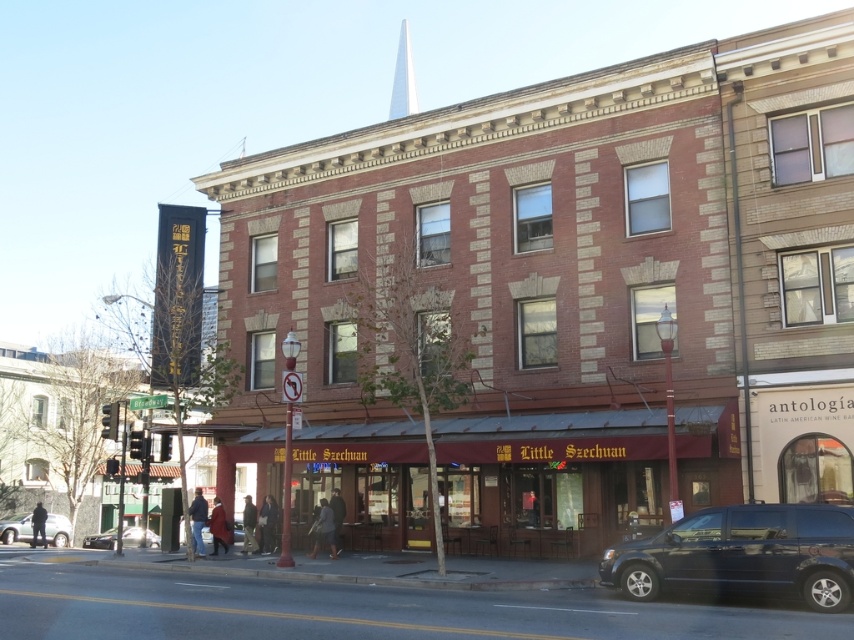
Question: Which is farther from the white smooth spire at upper center?

Choices:
 (A) silver metallic sedan at lower left
 (B) shiny black van at lower right
 (C) metallic silver car at lower left

Answer: (B)

Question: Is shiny black van at lower right above metallic silver car at lower left?

Choices:
 (A) yes
 (B) no

Answer: (A)

Question: Can you confirm if silver metallic sedan at lower left is positioned to the right of metallic silver car at lower left?

Choices:
 (A) no
 (B) yes

Answer: (A)

Question: Which of the following is the closest to the observer?

Choices:
 (A) (22, 540)
 (B) (755, 544)
 (C) (130, 531)

Answer: (B)

Question: Which of the following is the farthest from the observer?

Choices:
 (A) shiny black van at lower right
 (B) metallic silver car at lower left

Answer: (B)

Question: From the image, what is the correct spatial relationship of shiny black van at lower right in relation to metallic silver car at lower left?

Choices:
 (A) below
 (B) above

Answer: (B)